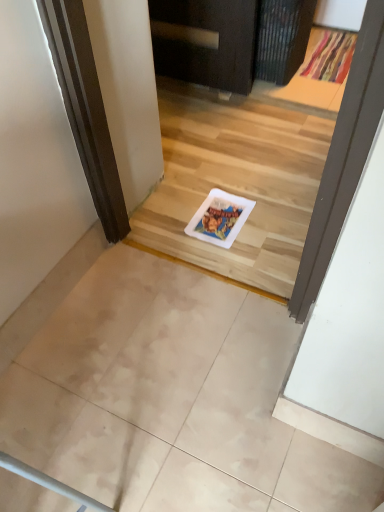
What is the approximate width of textured fabric doormat at upper right?

24.80 inches.

Where is `textured fabric doormat at upper right`? textured fabric doormat at upper right is located at coordinates (331, 57).

What do you see at coordinates (331, 57) in the screenshot? This screenshot has width=384, height=512. I see `textured fabric doormat at upper right` at bounding box center [331, 57].

In order to face textured fabric doormat at upper right, should I rotate leftwards or rightwards?

Rotate right and turn 18.505 degrees.

The image size is (384, 512). What do you see at coordinates (34, 416) in the screenshot? I see `matte beige tile at lower left` at bounding box center [34, 416].

Where is `matte beige tile at lower left`? matte beige tile at lower left is located at coordinates (34, 416).

In order to face matte beige tile at lower left, should I rotate leftwards or rightwards?

Rotate your view left by about 27.645°.

Where is `textured fabric doormat at upper right`? This screenshot has height=512, width=384. textured fabric doormat at upper right is located at coordinates (331, 57).

Between matte beige tile at lower left and textured fabric doormat at upper right, which one appears on the right side from the viewer's perspective?

Positioned to the right is textured fabric doormat at upper right.

Considering the positions of objects matte beige tile at lower left and textured fabric doormat at upper right in the image provided, who is behind, matte beige tile at lower left or textured fabric doormat at upper right?

textured fabric doormat at upper right is behind.

Is point (53, 388) closer to viewer compared to point (320, 47)?

Yes, point (53, 388) is in front of point (320, 47).

From the image's perspective, is matte beige tile at lower left under textured fabric doormat at upper right?

Yes, from the image's perspective, matte beige tile at lower left is beneath textured fabric doormat at upper right.

Consider the image. From a real-world perspective, relative to textured fabric doormat at upper right, is matte beige tile at lower left vertically above or below?

matte beige tile at lower left is above textured fabric doormat at upper right.

Based on the photo, which of these two, matte beige tile at lower left or textured fabric doormat at upper right, is thinner?

Thinner between the two is matte beige tile at lower left.

Does matte beige tile at lower left have a greater height compared to textured fabric doormat at upper right?

Yes, matte beige tile at lower left is taller than textured fabric doormat at upper right.

Looking at the image, does matte beige tile at lower left seem bigger or smaller compared to textured fabric doormat at upper right?

In the image, matte beige tile at lower left appears to be larger than textured fabric doormat at upper right.

Is matte beige tile at lower left completely or partially outside of textured fabric doormat at upper right?

Yes.

Is matte beige tile at lower left not near textured fabric doormat at upper right?

Yes.

In the scene shown: Does matte beige tile at lower left turn towards textured fabric doormat at upper right?

No.

Image resolution: width=384 pixels, height=512 pixels. Find the location of `doormat behind the matte beige tile at lower left`. doormat behind the matte beige tile at lower left is located at coordinates (331, 57).

Considering the positions of objects textured fabric doormat at upper right and matte beige tile at lower left in the image provided, who is more to the left, textured fabric doormat at upper right or matte beige tile at lower left?

From the viewer's perspective, matte beige tile at lower left appears more on the left side.

Which object is closer to the camera, textured fabric doormat at upper right or matte beige tile at lower left?

matte beige tile at lower left is closer to the camera.

Between point (304, 70) and point (32, 390), which one is positioned in front?

The point (32, 390) is closer to the camera.

From the image's perspective, which object appears higher, textured fabric doormat at upper right or matte beige tile at lower left?

textured fabric doormat at upper right.

From a real-world perspective, which object stands above the other?

matte beige tile at lower left.

Which object is wider, textured fabric doormat at upper right or matte beige tile at lower left?

With larger width is textured fabric doormat at upper right.

Who is shorter, textured fabric doormat at upper right or matte beige tile at lower left?

With less height is textured fabric doormat at upper right.

In terms of size, does textured fabric doormat at upper right appear bigger or smaller than matte beige tile at lower left?

Considering their sizes, textured fabric doormat at upper right takes up less space than matte beige tile at lower left.

Is matte beige tile at lower left located within textured fabric doormat at upper right?

No, matte beige tile at lower left is located outside of textured fabric doormat at upper right.

Does textured fabric doormat at upper right touch matte beige tile at lower left?

textured fabric doormat at upper right and matte beige tile at lower left are not in contact.

Is matte beige tile at lower left at the back of textured fabric doormat at upper right?

textured fabric doormat at upper right does not have its back to matte beige tile at lower left.

Identify the location of ceramic tile that is above the textured fabric doormat at upper right (from a real-world perspective). This screenshot has height=512, width=384. (34, 416).

Where is `ceramic tile below the textured fabric doormat at upper right (from the image's perspective)`? The height and width of the screenshot is (512, 384). ceramic tile below the textured fabric doormat at upper right (from the image's perspective) is located at coordinates (34, 416).

This screenshot has height=512, width=384. Find the location of `doormat on the right of matte beige tile at lower left`. doormat on the right of matte beige tile at lower left is located at coordinates (331, 57).